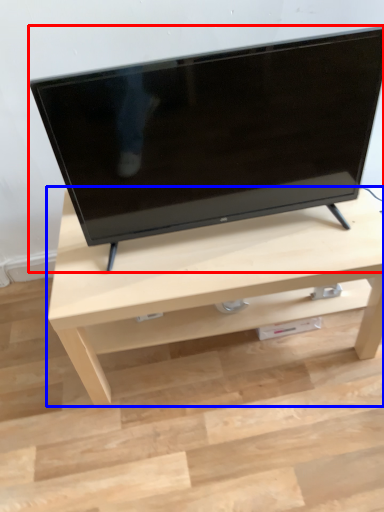
Question: Among these objects, which one is nearest to the camera, television (highlighted by a red box) or table (highlighted by a blue box)?

Choices:
 (A) television
 (B) table

Answer: (A)